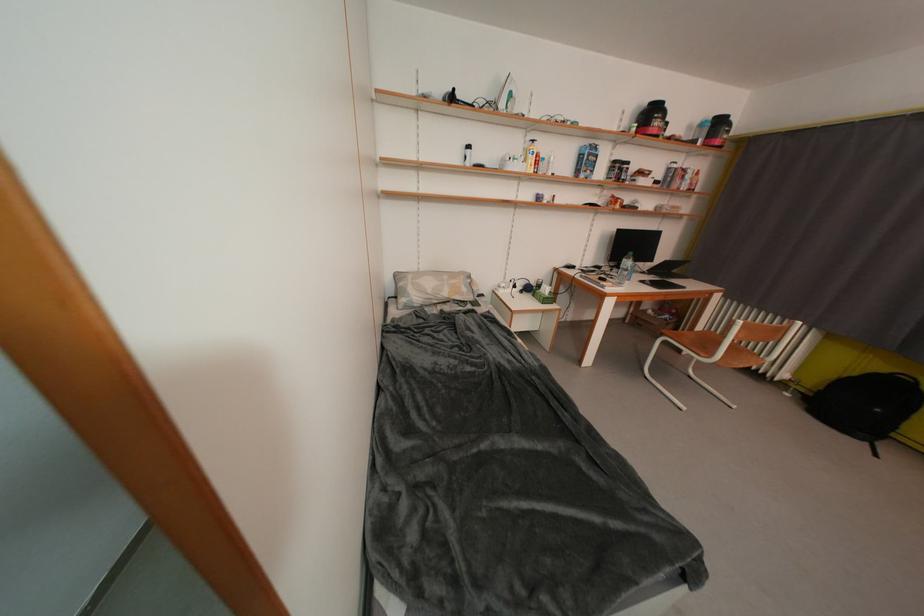
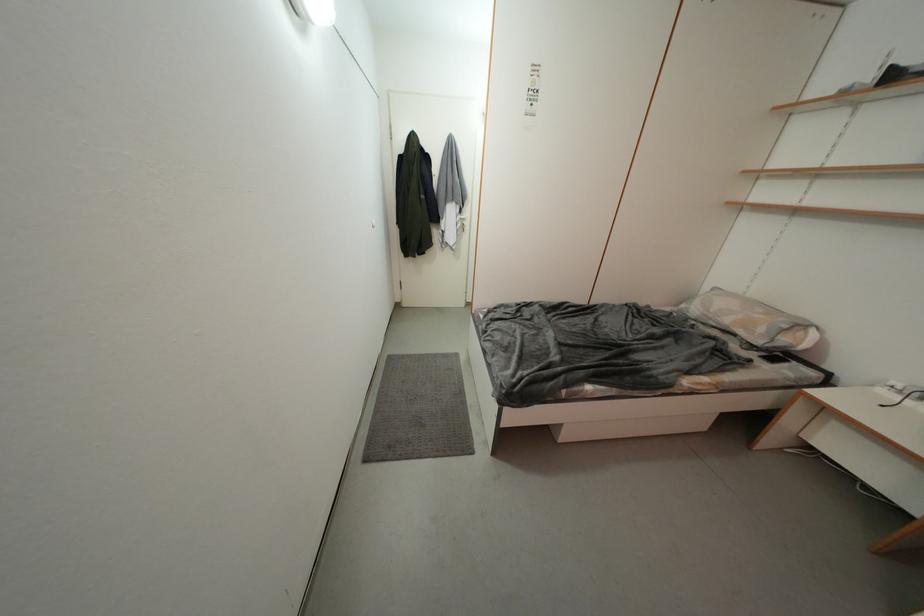
Find the pixel in the second image that matches point (471, 293) in the first image.

(769, 333)